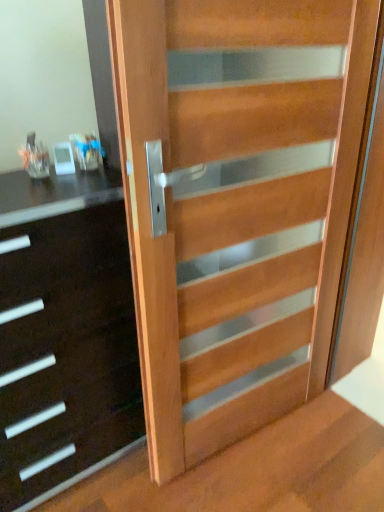
Question: In terms of width, does natural wood door at center look wider or thinner when compared to black glossy chest of drawers at left?

Choices:
 (A) thin
 (B) wide

Answer: (A)

Question: In terms of size, does natural wood door at center appear bigger or smaller than black glossy chest of drawers at left?

Choices:
 (A) big
 (B) small

Answer: (B)

Question: Which object is the farthest from the natural wood door at center?

Choices:
 (A) black glossy chest of drawers at left
 (B) wooden stairwell at lower right

Answer: (B)

Question: Considering the real-world distances, which object is closest to the wooden stairwell at lower right?

Choices:
 (A) natural wood door at center
 (B) black glossy chest of drawers at left

Answer: (B)